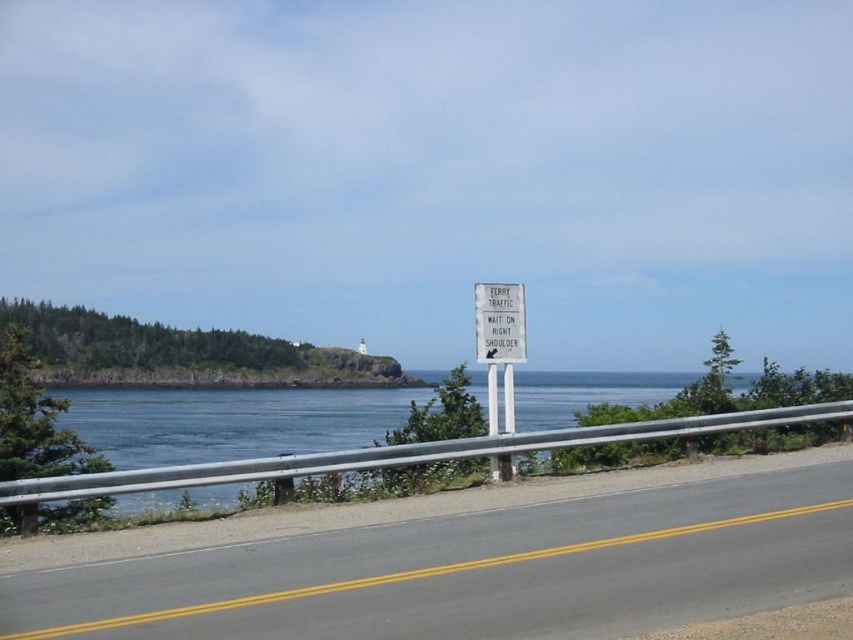
Does gray asphalt road at center have a greater height compared to white plastic sign at center?

No.

Does gray asphalt road at center appear on the right side of white plastic sign at center?

Incorrect, gray asphalt road at center is not on the right side of white plastic sign at center.

You are a GUI agent. You are given a task and a screenshot of the screen. Output one action in this format:
    pyautogui.click(x=<x>, y=<y>)
    Task: Click on the gray asphalt road at center
    
    Given the screenshot: What is the action you would take?
    pyautogui.click(x=471, y=570)

The height and width of the screenshot is (640, 853). Identify the location of gray asphalt road at center. (471, 570).